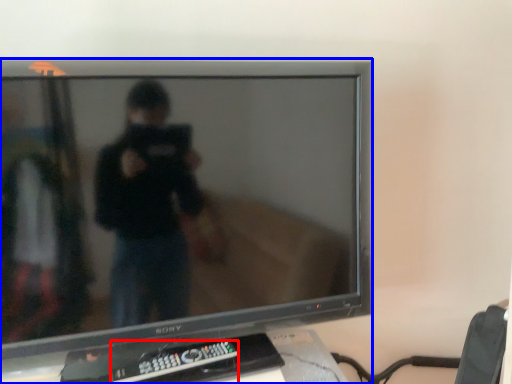
Question: Which point is closer to the camera, remote control (highlighted by a red box) or television (highlighted by a blue box)?

Choices:
 (A) remote control
 (B) television

Answer: (B)